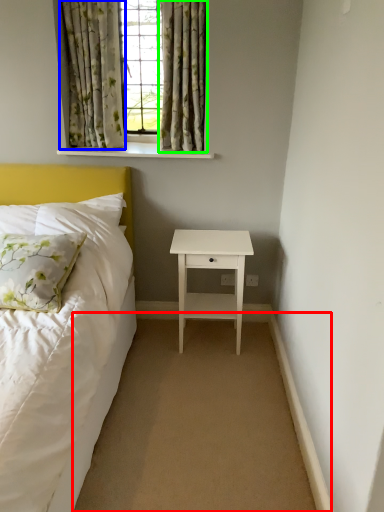
Question: Considering the real-world distances, which object is farthest from plain (highlighted by a red box)? curtain (highlighted by a blue box) or curtain (highlighted by a green box)?

Choices:
 (A) curtain
 (B) curtain

Answer: (A)